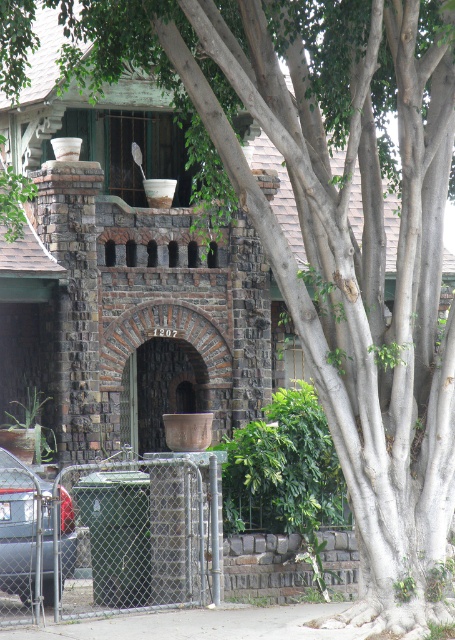
Can you confirm if metal chain-link fence at lower center is thinner than matte black car at lower left?

Incorrect, metal chain-link fence at lower center's width is not less than matte black car at lower left's.

Which is more to the right, metal chain-link fence at lower center or matte black car at lower left?

metal chain-link fence at lower center is more to the right.

Is point (20, 620) positioned behind point (0, 529)?

No, (20, 620) is in front of (0, 529).

What are the coordinates of `metal chain-link fence at lower center` in the screenshot? It's located at (111, 536).